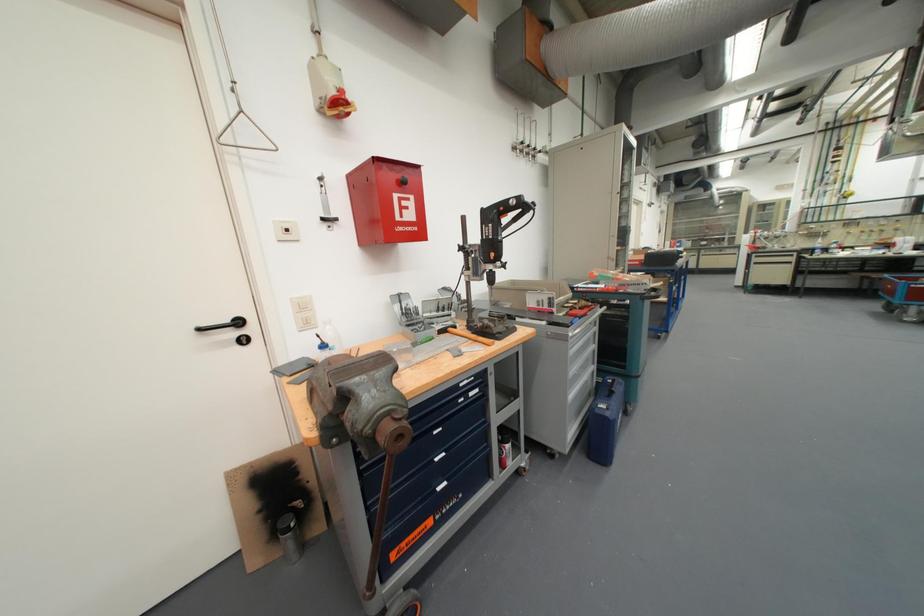
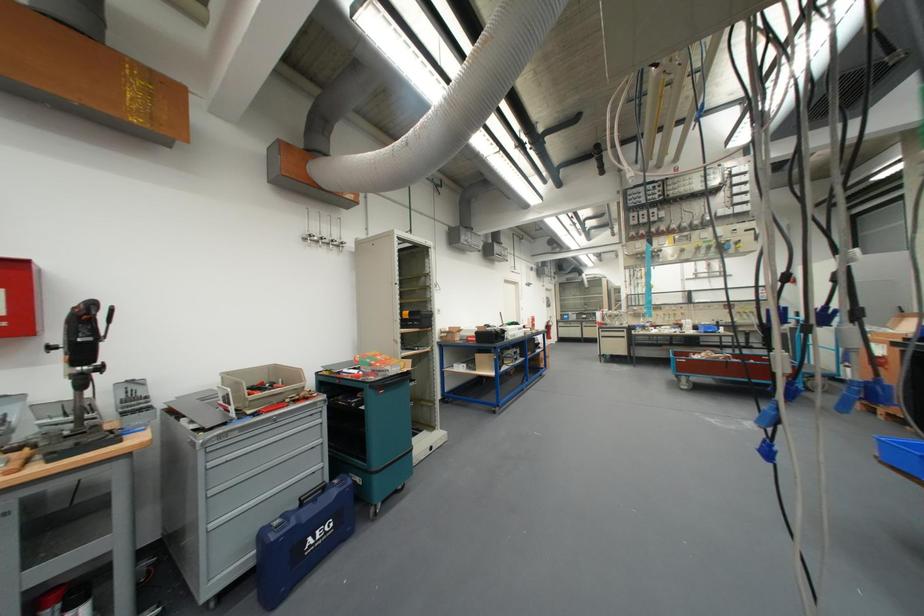
Question: Which direction would the cameraman need to move to produce the second image? Reply with the corresponding letter.

Choices:
 (A) Left
 (B) Right
 (C) Forward
 (D) Backward

Answer: (B)